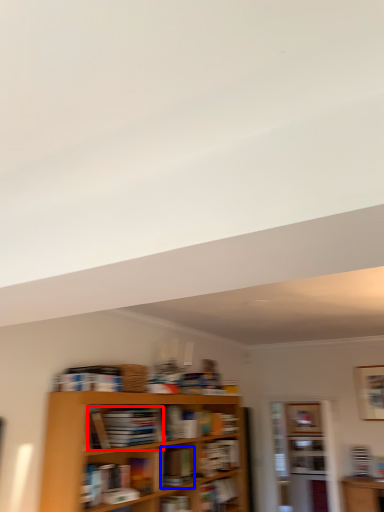
Question: Which object is further to the camera taking this photo, book (highlighted by a red box) or book (highlighted by a blue box)?

Choices:
 (A) book
 (B) book

Answer: (B)